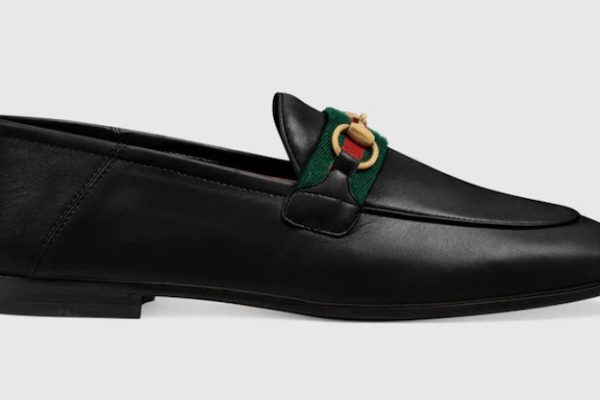
This screenshot has height=400, width=600. I want to click on wall, so [223, 75].